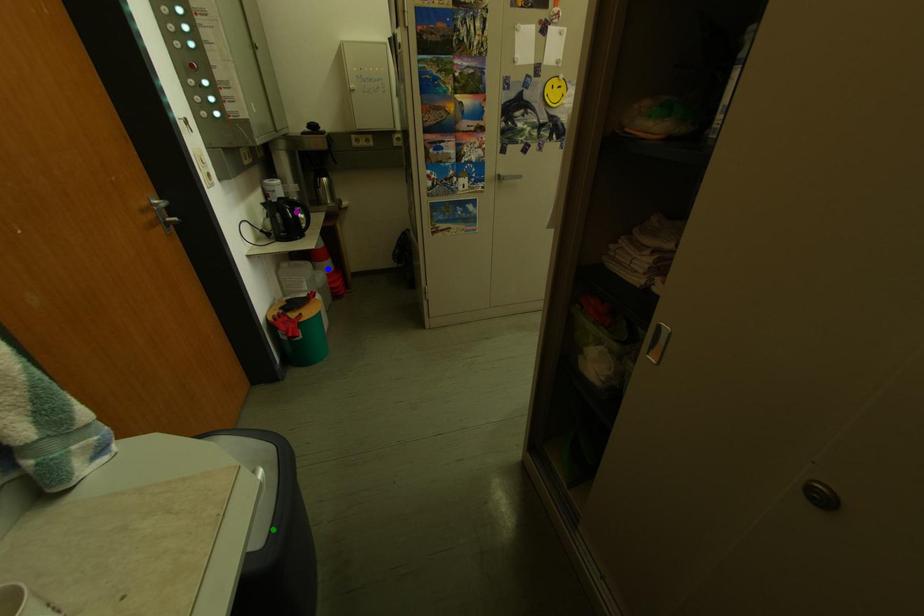
Based on the photo, order these from farthest to nearest:
A) green point
B) purple point
C) blue point

blue point, purple point, green point